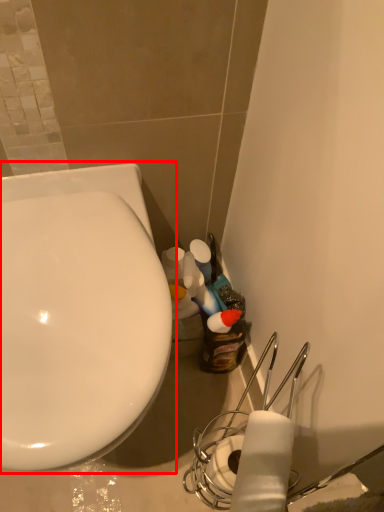
Question: Observing the image, what is the correct spatial positioning of toilet (annotated by the red box) in reference to toilet paper?

Choices:
 (A) right
 (B) left

Answer: (B)